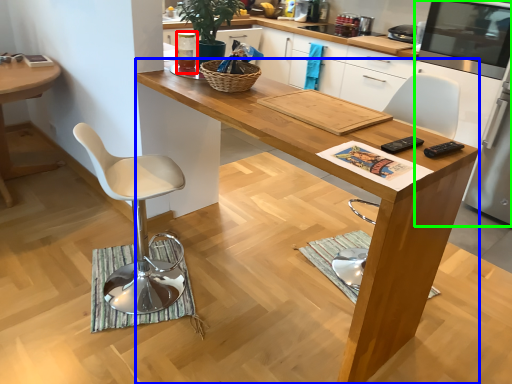
Question: Based on their relative distances, which object is farther from appliance (highlighted by a red box)? Choose from desk (highlighted by a blue box) and appliance (highlighted by a green box).

Choices:
 (A) desk
 (B) appliance

Answer: (B)